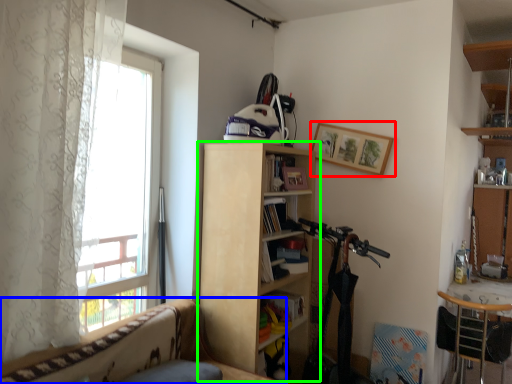
Question: Which object is the farthest from picture frame (highlighted by a red box)? Choose among these: studio couch (highlighted by a blue box) or bookcase (highlighted by a green box).

Choices:
 (A) studio couch
 (B) bookcase

Answer: (A)